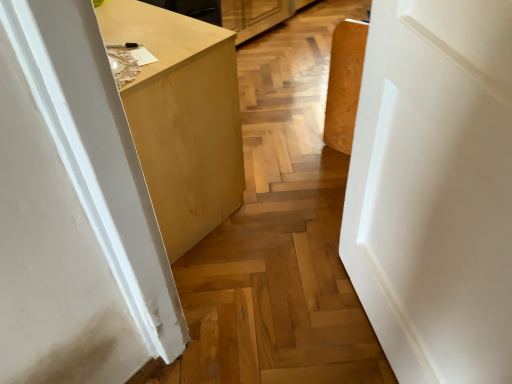
Locate an element on the screen. The width and height of the screenshot is (512, 384). unoccupied space behind white matte door at center is located at coordinates (298, 230).